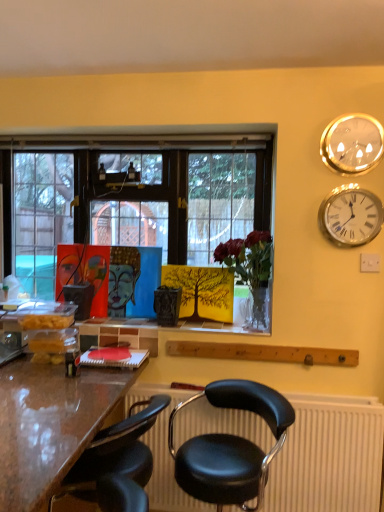
How much space does black leather chair at lower center, arranged as the second chair when viewed from the right, occupy horizontally?

The width of black leather chair at lower center, arranged as the second chair when viewed from the right, is 47.05 centimeters.

How much space does gold reflective glass wall clock at upper right, which is the first wall clock from top to bottom, occupy horizontally?

gold reflective glass wall clock at upper right, which is the first wall clock from top to bottom, is 1.83 inches in width.

Where is `blue glossy painting at center`? blue glossy painting at center is located at coordinates (122, 278).

The width and height of the screenshot is (384, 512). What do you see at coordinates (351, 216) in the screenshot? I see `silver metallic clock at upper right, which is the 1th wall clock from bottom to top` at bounding box center [351, 216].

What do you see at coordinates (49, 425) in the screenshot? I see `shiny brown desk at lower left` at bounding box center [49, 425].

Where is `black leather chair at center, marked as the second chair in a left-to-right arrangement`? Image resolution: width=384 pixels, height=512 pixels. black leather chair at center, marked as the second chair in a left-to-right arrangement is located at coordinates (231, 447).

Locate an element on the screen. Image resolution: width=384 pixels, height=512 pixels. translucent glass vase at center is located at coordinates (250, 270).

Which is behind, point (339, 470) or point (255, 307)?

The point (255, 307) is behind.

From the image's perspective, which one is positioned lower, black plastic radiator at lower center or translucent glass vase at center?

black plastic radiator at lower center, from the image's perspective.

Considering the sizes of objects black plastic radiator at lower center and translucent glass vase at center in the image provided, who is taller, black plastic radiator at lower center or translucent glass vase at center?

black plastic radiator at lower center.

Between black plastic radiator at lower center and translucent glass vase at center, which one has smaller width?

Thinner between the two is black plastic radiator at lower center.

Is gold reflective glass wall clock at upper right, positioned as the second wall clock in bottom-to-top order, outside of translucent glass vase at center?

Indeed, gold reflective glass wall clock at upper right, positioned as the second wall clock in bottom-to-top order, is completely outside translucent glass vase at center.

Between point (357, 163) and point (236, 254), which one is positioned behind?

The point (236, 254) is behind.

From a real-world perspective, is gold reflective glass wall clock at upper right, positioned as the second wall clock in bottom-to-top order, under translucent glass vase at center?

Actually, gold reflective glass wall clock at upper right, positioned as the second wall clock in bottom-to-top order, is physically above translucent glass vase at center in the real world.

Does silver metallic clock at upper right, which is the 1th wall clock from bottom to top, lie behind blue glossy painting at center?

No.

From the image's perspective, is silver metallic clock at upper right, which is the 1th wall clock from bottom to top, on blue glossy painting at center?

Yes, from the image's perspective, silver metallic clock at upper right, which is the 1th wall clock from bottom to top, is over blue glossy painting at center.

From a real-world perspective, which is physically above, silver metallic clock at upper right, acting as the second wall clock starting from the top, or blue glossy painting at center?

From a 3D spatial view, silver metallic clock at upper right, acting as the second wall clock starting from the top, is above.

At what (x,y) coordinates should I click in order to perform the action: click on the 1st wall clock directly above the blue glossy painting at center (from a real-world perspective). Please return your answer as a coordinate pair (x, y). The height and width of the screenshot is (512, 384). Looking at the image, I should click on (351, 216).

From the image's perspective, is shiny brown desk at lower left positioned above or below gold reflective glass wall clock at upper right, which is the first wall clock from top to bottom?

shiny brown desk at lower left is situated lower than gold reflective glass wall clock at upper right, which is the first wall clock from top to bottom, in the image.

Considering the relative sizes of shiny brown desk at lower left and gold reflective glass wall clock at upper right, positioned as the second wall clock in bottom-to-top order, in the image provided, is shiny brown desk at lower left bigger than gold reflective glass wall clock at upper right, positioned as the second wall clock in bottom-to-top order,?

Indeed, shiny brown desk at lower left has a larger size compared to gold reflective glass wall clock at upper right, positioned as the second wall clock in bottom-to-top order.

Choose the correct answer: Is shiny brown desk at lower left inside gold reflective glass wall clock at upper right, which is the first wall clock from top to bottom, or outside it?

shiny brown desk at lower left exists outside the volume of gold reflective glass wall clock at upper right, which is the first wall clock from top to bottom.

How different are the orientations of shiny brown desk at lower left and gold reflective glass wall clock at upper right, positioned as the second wall clock in bottom-to-top order, in degrees?

shiny brown desk at lower left and gold reflective glass wall clock at upper right, positioned as the second wall clock in bottom-to-top order, are facing 91.6 degrees away from each other.

Between silver metallic clock at upper right, which is the 1th wall clock from bottom to top, and black leather chair at lower center, arranged as the second chair when viewed from the right, which one has larger width?

With larger width is black leather chair at lower center, arranged as the second chair when viewed from the right.

Is silver metallic clock at upper right, which is the 1th wall clock from bottom to top, far away from black leather chair at lower center, the first chair when ordered from left to right?

Yes.

Considering the relative sizes of silver metallic clock at upper right, acting as the second wall clock starting from the top, and black leather chair at lower center, the first chair when ordered from left to right, in the image provided, is silver metallic clock at upper right, acting as the second wall clock starting from the top, taller than black leather chair at lower center, the first chair when ordered from left to right,?

No, silver metallic clock at upper right, acting as the second wall clock starting from the top, is not taller than black leather chair at lower center, the first chair when ordered from left to right.

There is a silver metallic clock at upper right, acting as the second wall clock starting from the top. Identify the location of the 1st chair below it (from the image's perspective). (116, 463).

Considering the sizes of objects black leather chair at center, the first chair when ordered from right to left, and black plastic radiator at lower center in the image provided, who is bigger, black leather chair at center, the first chair when ordered from right to left, or black plastic radiator at lower center?

black leather chair at center, the first chair when ordered from right to left.

Which object is positioned more to the left, black leather chair at center, the first chair when ordered from right to left, or black plastic radiator at lower center?

Positioned to the left is black leather chair at center, the first chair when ordered from right to left.

Looking at this image, are black leather chair at center, the first chair when ordered from right to left, and black plastic radiator at lower center beside each other?

No, black leather chair at center, the first chair when ordered from right to left, is not beside black plastic radiator at lower center.

From the picture: Which of these two, black leather chair at center, the first chair when ordered from right to left, or black plastic radiator at lower center, stands shorter?

black plastic radiator at lower center.

Considering the relative positions of shiny brown desk at lower left and black leather chair at lower center, arranged as the second chair when viewed from the right, in the image provided, is shiny brown desk at lower left to the right of black leather chair at lower center, arranged as the second chair when viewed from the right, from the viewer's perspective?

No.

Can you tell me how much shiny brown desk at lower left and black leather chair at lower center, the first chair when ordered from left to right, differ in facing direction?

0.332 degrees separate the facing orientations of shiny brown desk at lower left and black leather chair at lower center, the first chair when ordered from left to right.

Measure the distance between shiny brown desk at lower left and black leather chair at lower center, arranged as the second chair when viewed from the right.

They are 9.19 inches apart.

Could you tell me if shiny brown desk at lower left is facing black leather chair at lower center, arranged as the second chair when viewed from the right?

Yes, shiny brown desk at lower left is turned towards black leather chair at lower center, arranged as the second chair when viewed from the right.

Locate an element on the screen. The width and height of the screenshot is (384, 512). houseplant behind the black plastic radiator at lower center is located at coordinates (250, 270).

I want to click on the 2nd wall clock above the translucent glass vase at center (from the image's perspective), so click(352, 144).

From the image, which object appears to be nearer to blue glossy painting at center, black leather chair at lower center, the first chair when ordered from left to right, or black leather chair at center, the first chair when ordered from right to left?

Based on the image, black leather chair at lower center, the first chair when ordered from left to right, appears to be nearer to blue glossy painting at center.

Estimate the real-world distances between objects in this image. Which object is closer to black plastic radiator at lower center, gold reflective glass wall clock at upper right, which is the first wall clock from top to bottom, or blue glossy painting at center?

blue glossy painting at center.

Looking at the image, which one is located closer to black plastic radiator at lower center, gold reflective glass wall clock at upper right, positioned as the second wall clock in bottom-to-top order, or black leather chair at center, the first chair when ordered from right to left?

The object closer to black plastic radiator at lower center is black leather chair at center, the first chair when ordered from right to left.

Estimate the real-world distances between objects in this image. Which object is further from blue glossy painting at center, silver metallic clock at upper right, acting as the second wall clock starting from the top, or shiny brown desk at lower left?

Among the two, silver metallic clock at upper right, acting as the second wall clock starting from the top, is located further to blue glossy painting at center.

From the picture: Estimate the real-world distances between objects in this image. Which object is closer to translucent glass vase at center, blue glossy painting at center or black plastic radiator at lower center?

blue glossy painting at center is positioned closer to the anchor translucent glass vase at center.

Looking at the image, which one is located further to gold reflective glass wall clock at upper right, which is the first wall clock from top to bottom, blue glossy painting at center or translucent glass vase at center?

The object further to gold reflective glass wall clock at upper right, which is the first wall clock from top to bottom, is blue glossy painting at center.

Which object lies nearer to the anchor point translucent glass vase at center, blue glossy painting at center or gold reflective glass wall clock at upper right, positioned as the second wall clock in bottom-to-top order?

The object closer to translucent glass vase at center is blue glossy painting at center.

Looking at the image, which one is located closer to blue glossy painting at center, silver metallic clock at upper right, which is the 1th wall clock from bottom to top, or black leather chair at lower center, arranged as the second chair when viewed from the right?

The object closer to blue glossy painting at center is black leather chair at lower center, arranged as the second chair when viewed from the right.

At what (x,y) coordinates should I click in order to perform the action: click on houseplant between blue glossy painting at center and silver metallic clock at upper right, which is the 1th wall clock from bottom to top, in the horizontal direction. Please return your answer as a coordinate pair (x, y). The width and height of the screenshot is (384, 512). Looking at the image, I should click on click(x=250, y=270).

Where is `person between translucent glass vase at center and black plastic radiator at lower center vertically`? person between translucent glass vase at center and black plastic radiator at lower center vertically is located at coordinates (122, 278).

This screenshot has width=384, height=512. I want to click on houseplant between gold reflective glass wall clock at upper right, which is the first wall clock from top to bottom, and black leather chair at center, the first chair when ordered from right to left, from top to bottom, so click(x=250, y=270).

Where is `houseplant between gold reflective glass wall clock at upper right, positioned as the second wall clock in bottom-to-top order, and black plastic radiator at lower center in the up-down direction`? houseplant between gold reflective glass wall clock at upper right, positioned as the second wall clock in bottom-to-top order, and black plastic radiator at lower center in the up-down direction is located at coordinates (250, 270).